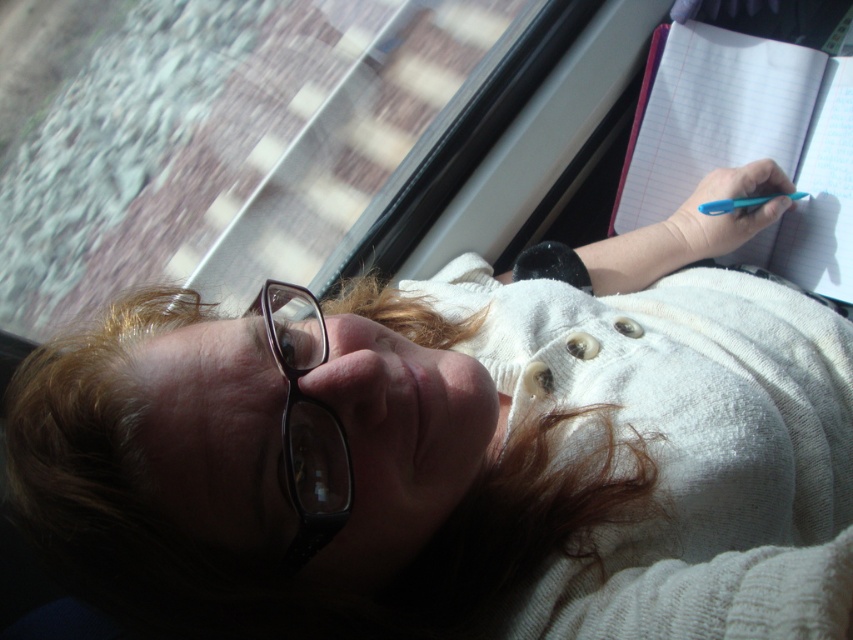
Question: Among these objects, which one is farthest from the camera?

Choices:
 (A) pink paper notebook at upper right
 (B) matte white sweater at center
 (C) transparent glass train window at upper center

Answer: (C)

Question: Does matte white sweater at center appear on the right side of transparent glass train window at upper center?

Choices:
 (A) yes
 (B) no

Answer: (A)

Question: Does matte white sweater at center appear on the left side of pink paper notebook at upper right?

Choices:
 (A) yes
 (B) no

Answer: (A)

Question: Which object appears closest to the camera in this image?

Choices:
 (A) pink paper notebook at upper right
 (B) black plastic glasses at lower left
 (C) matte white sweater at center

Answer: (C)

Question: Does matte white sweater at center lie in front of black plastic glasses at lower left?

Choices:
 (A) yes
 (B) no

Answer: (A)

Question: Which object is positioned closest to the matte white sweater at center?

Choices:
 (A) black plastic glasses at lower left
 (B) transparent glass train window at upper center
 (C) pink paper notebook at upper right

Answer: (A)